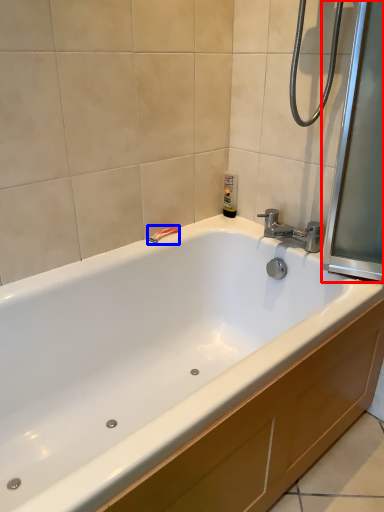
Question: Among these objects, which one is nearest to the camera, screen door (highlighted by a red box) or shower (highlighted by a blue box)?

Choices:
 (A) screen door
 (B) shower

Answer: (A)